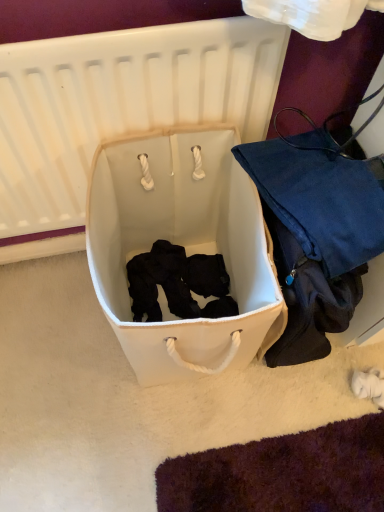
Question: Considering the relative sizes of white fabric laundry basket at center and white fabric infant bed at center in the image provided, is white fabric laundry basket at center smaller than white fabric infant bed at center?

Choices:
 (A) yes
 (B) no

Answer: (B)

Question: Is white fabric laundry basket at center further to the viewer compared to white fabric infant bed at center?

Choices:
 (A) no
 (B) yes

Answer: (B)

Question: Is white fabric laundry basket at center wider than white fabric infant bed at center?

Choices:
 (A) no
 (B) yes

Answer: (B)

Question: Would you consider white fabric laundry basket at center to be distant from white fabric infant bed at center?

Choices:
 (A) no
 (B) yes

Answer: (A)

Question: Does white fabric laundry basket at center have a larger size compared to white fabric infant bed at center?

Choices:
 (A) yes
 (B) no

Answer: (A)

Question: Visually, is white fabric infant bed at center positioned to the left or to the right of white fabric laundry basket at center?

Choices:
 (A) left
 (B) right

Answer: (A)

Question: Is point (243, 71) positioned closer to the camera than point (135, 335)?

Choices:
 (A) farther
 (B) closer

Answer: (A)

Question: Is white fabric infant bed at center bigger or smaller than white fabric laundry basket at center?

Choices:
 (A) small
 (B) big

Answer: (A)

Question: Considering their positions, is white fabric infant bed at center located in front of or behind white fabric laundry basket at center?

Choices:
 (A) behind
 (B) front

Answer: (B)

Question: From a real-world perspective, is white fabric infant bed at center positioned above or below matte blue fabric bag at right?

Choices:
 (A) below
 (B) above

Answer: (B)

Question: From the image's perspective, is white fabric infant bed at center above or below matte blue fabric bag at right?

Choices:
 (A) below
 (B) above

Answer: (B)

Question: Is white fabric infant bed at center wider or thinner than matte blue fabric bag at right?

Choices:
 (A) wide
 (B) thin

Answer: (B)

Question: Considering the positions of point (92, 77) and point (317, 271), is point (92, 77) closer or farther from the camera than point (317, 271)?

Choices:
 (A) closer
 (B) farther

Answer: (A)

Question: From a real-world perspective, is white fabric laundry basket at center positioned above or below white fabric infant bed at center?

Choices:
 (A) above
 (B) below

Answer: (B)

Question: Considering their positions, is white fabric laundry basket at center located in front of or behind white fabric infant bed at center?

Choices:
 (A) front
 (B) behind

Answer: (B)